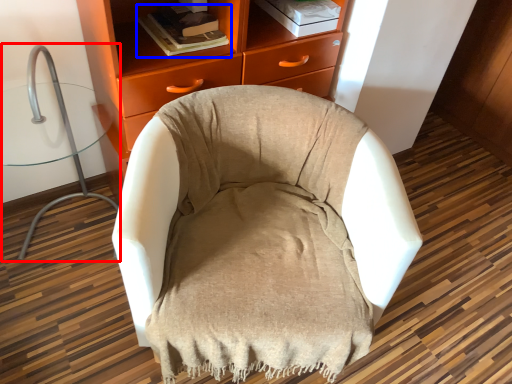
Question: Which object appears closest to the camera in this image, computer chair (highlighted by a red box) or book (highlighted by a blue box)?

Choices:
 (A) computer chair
 (B) book

Answer: (A)